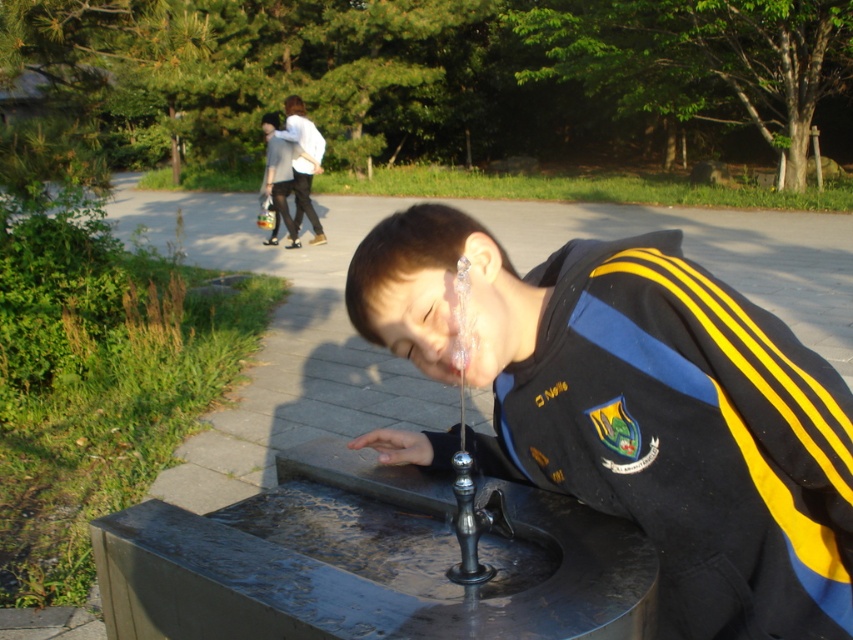
You are a photographer trying to capture the shiny black jacket at center and the polished metal faucet at center in a single shot. Since both are at the center, how can you ensure both are in focus?

The shiny black jacket at center is in front of the polished metal faucet at center. To ensure both are in focus, adjust the camera to focus on the shiny black jacket at center first, as it is closer, and use a smaller aperture for a deeper depth of field to include the polished metal faucet at center in the background.

You are a photographer trying to capture both the shiny black jacket at center and the polished metal faucet at center in a single frame. What is the minimum distance you need to move backward to ensure both objects are fully visible in your camera viewfinder?

The minimum distance you need to move backward is 9.11 inches to ensure both the shiny black jacket at center and the polished metal faucet at center are fully visible in your camera viewfinder.

You are a photographer trying to capture a closeup of the polished metal faucet at center without the shiny black jacket at center blocking the view. Is the jacket too large to fit entirely out of the frame if you position yourself directly behind it?

The shiny black jacket at center is bigger than the polished metal faucet at center, so positioning yourself directly behind the jacket would still block the faucet since the jacket is larger in size.